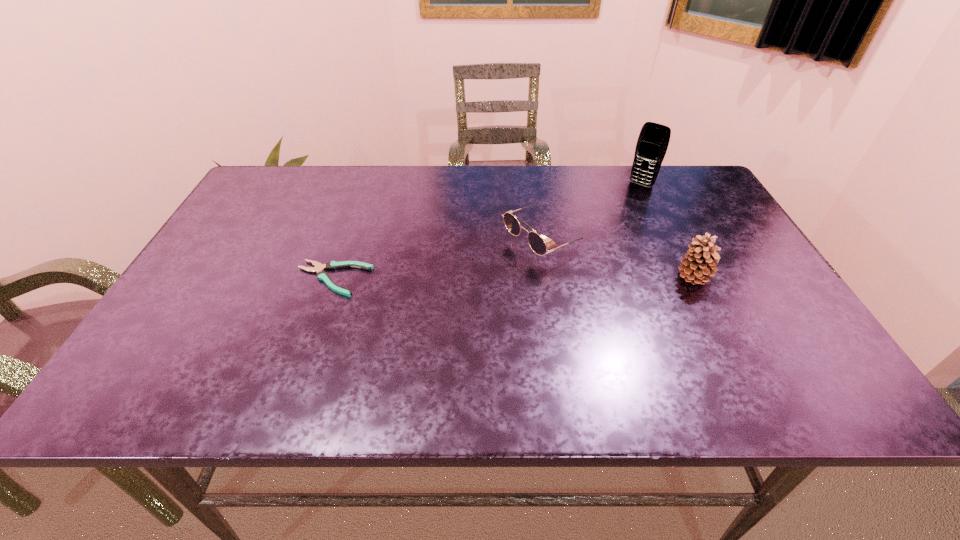
Locate an element on the screen. Image resolution: width=960 pixels, height=540 pixels. pliers is located at coordinates (319, 268).

Identify the location of the leftmost object. The image size is (960, 540). (319, 268).

Locate an element on the screen. the second tallest object is located at coordinates (700, 260).

The width and height of the screenshot is (960, 540). In order to click on sunglasses in this screenshot , I will do `click(536, 242)`.

I want to click on the third object from right to left, so click(536, 242).

This screenshot has height=540, width=960. I want to click on the tallest object, so click(653, 140).

Find the location of a particular element. the farthest object is located at coordinates (653, 140).

At what (x,y) coordinates should I click in order to perform the action: click on free space located on the left of the leftmost object. Please return your answer as a coordinate pair (x, y). This screenshot has height=540, width=960. Looking at the image, I should click on (230, 279).

Find the location of a particular element. This screenshot has width=960, height=540. vacant space situated on the front of the third shortest object is located at coordinates (734, 359).

The height and width of the screenshot is (540, 960). I want to click on vacant region located on the front lenses of the third tallest object, so click(365, 330).